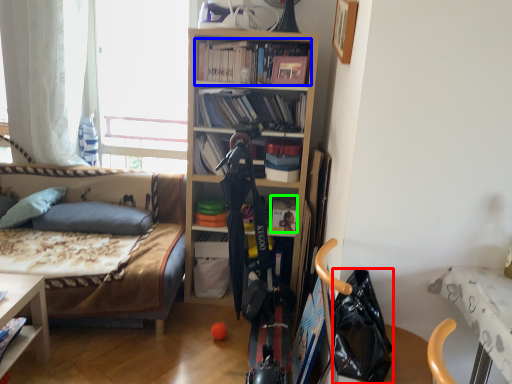
Question: Which object is the closest to the handbag (highlighted by a red box)? Choose among these: book (highlighted by a blue box) or book (highlighted by a green box).

Choices:
 (A) book
 (B) book

Answer: (B)